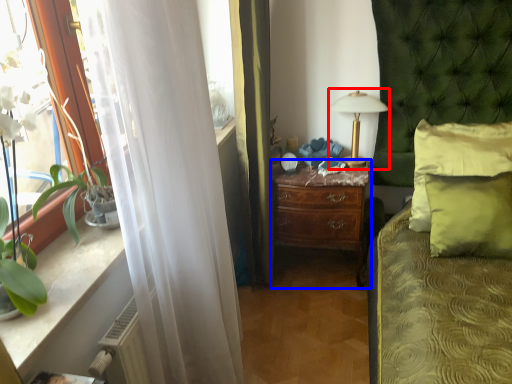
Question: Which of the following is the closest to the observer, table lamp (highlighted by a red box) or nightstand (highlighted by a blue box)?

Choices:
 (A) table lamp
 (B) nightstand

Answer: (A)